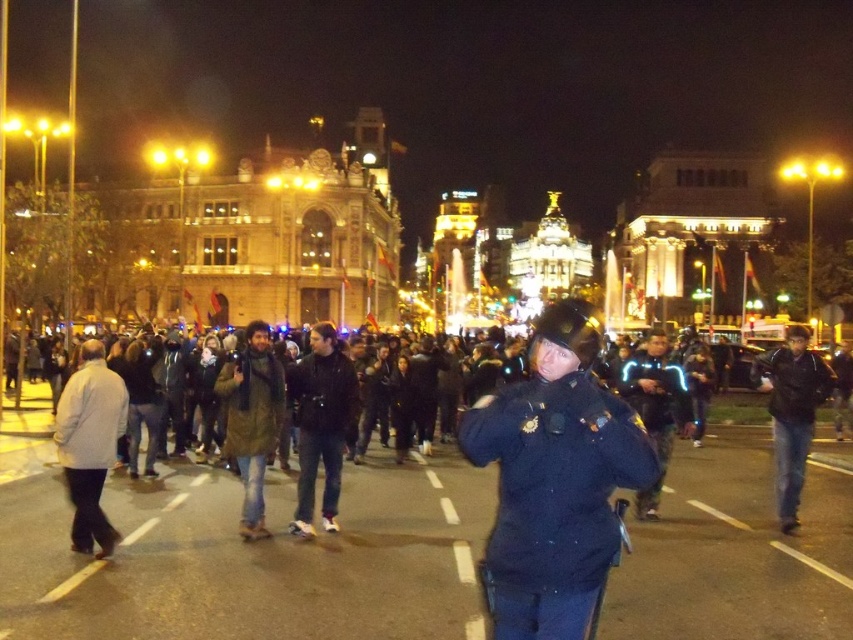
Question: Can you confirm if light beige jacket at left is positioned above black reflective jacket at center?

Choices:
 (A) yes
 (B) no

Answer: (B)

Question: In this image, where is black uniformed officer at center located relative to light beige jacket at left?

Choices:
 (A) left
 (B) right

Answer: (B)

Question: Which point is farther to the camera?

Choices:
 (A) black leather jacket at center
 (B) light beige jacket at left
 (C) black uniformed officer at center
 (D) black reflective jacket at center

Answer: (A)

Question: Does green textured coat at center have a greater width compared to jeans at right?

Choices:
 (A) yes
 (B) no

Answer: (B)

Question: Which point is farther to the camera?

Choices:
 (A) black reflective jacket at center
 (B) black leather jacket at center
 (C) light beige jacket at left

Answer: (B)

Question: Which point is farther from the camera taking this photo?

Choices:
 (A) (310, 525)
 (B) (621, 390)

Answer: (B)